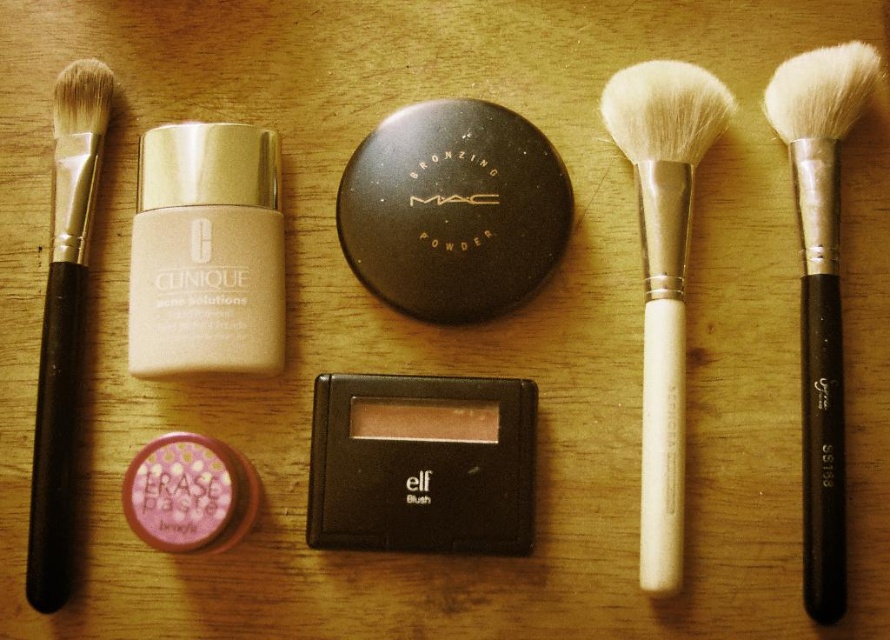
Who is lower down, matte cream foundation at upper left or white wood-handled brush at center-right?

Positioned lower is white wood-handled brush at center-right.

Find the location of a particular element. matte cream foundation at upper left is located at coordinates (206, 252).

Is point (249, 324) farther from viewer compared to point (55, 476)?

Yes, point (249, 324) is farther from viewer.

Who is positioned more to the right, matte cream foundation at upper left or black matte brush at left?

Positioned to the right is matte cream foundation at upper left.

Measure the distance between matte cream foundation at upper left and camera.

They are 3.97 feet apart.

The height and width of the screenshot is (640, 890). Find the location of `matte cream foundation at upper left`. matte cream foundation at upper left is located at coordinates (206, 252).

Does point (678, 442) come in front of point (47, 518)?

That is False.

Consider the image. Can you confirm if white wood-handled brush at center-right is positioned above black matte brush at left?

Yes, white wood-handled brush at center-right is above black matte brush at left.

Does point (684, 152) lie behind point (47, 326)?

Yes.

Identify the location of white wood-handled brush at center-right. Image resolution: width=890 pixels, height=640 pixels. (662, 275).